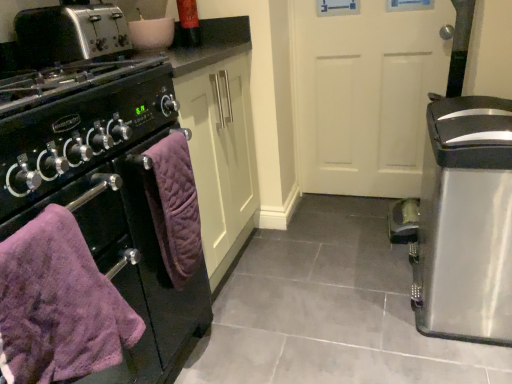
What do you see at coordinates (462, 222) in the screenshot?
I see `satin silver trash can at right` at bounding box center [462, 222].

What do you see at coordinates (70, 33) in the screenshot?
I see `silver metallic toaster at upper left` at bounding box center [70, 33].

What do you see at coordinates (104, 191) in the screenshot? I see `matte black oven at left` at bounding box center [104, 191].

Measure the distance between matte black oven at left and camera.

The distance of matte black oven at left from camera is 27.02 inches.

The height and width of the screenshot is (384, 512). Describe the element at coordinates (59, 304) in the screenshot. I see `purple quilted towel at left, arranged as the second bath towel when viewed from the back` at that location.

In order to click on purple quilted towel at left, the first bath towel in the front-to-back sequence in this screenshot , I will do `click(59, 304)`.

Identify the location of purple quilted towel at lower left, the 1th bath towel when ordered from back to front. (174, 206).

Image resolution: width=512 pixels, height=384 pixels. Describe the element at coordinates (366, 91) in the screenshot. I see `white matte door at center` at that location.

At what (x,y) coordinates should I click in order to perform the action: click on satin silver trash can at right. Please return your answer as a coordinate pair (x, y). Looking at the image, I should click on [x=462, y=222].

Can you confirm if satin silver trash can at right is taller than purple quilted towel at lower left, which appears as the 2th bath towel when viewed from the front?

Correct, satin silver trash can at right is much taller as purple quilted towel at lower left, which appears as the 2th bath towel when viewed from the front.

Is there a large distance between satin silver trash can at right and purple quilted towel at lower left, which appears as the 2th bath towel when viewed from the front?

No, satin silver trash can at right is not far away from purple quilted towel at lower left, which appears as the 2th bath towel when viewed from the front.

From the image's perspective, which bath towel is the 1st one below the satin silver trash can at right? Please provide its 2D coordinates.

[(174, 206)]

Is satin silver trash can at right situated inside purple quilted towel at lower left, the 1th bath towel when ordered from back to front, or outside?

satin silver trash can at right exists outside the volume of purple quilted towel at lower left, the 1th bath towel when ordered from back to front.

Is satin silver trash can at right inside the boundaries of matte black oven at left, or outside?

The correct answer is: outside.

In the scene shown: Is satin silver trash can at right shorter than matte black oven at left?

Yes.

Where is `kitchen appliance behind the matte black oven at left`? Image resolution: width=512 pixels, height=384 pixels. kitchen appliance behind the matte black oven at left is located at coordinates (462, 222).

From the image's perspective, does satin silver trash can at right appear higher than matte black oven at left?

Indeed, from the image's perspective, satin silver trash can at right is shown above matte black oven at left.

In the scene shown: Is silver metallic toaster at upper left located within white matte door at center?

No, silver metallic toaster at upper left is located outside of white matte door at center.

Measure the distance between white matte door at center and silver metallic toaster at upper left.

white matte door at center is 1.16 meters away from silver metallic toaster at upper left.

Is white matte door at center facing away from silver metallic toaster at upper left?

No.

Does white matte door at center have a lesser width compared to silver metallic toaster at upper left?

Indeed, white matte door at center has a lesser width compared to silver metallic toaster at upper left.

Considering their positions, is satin silver trash can at right located in front of or behind white matte door at center?

Clearly, satin silver trash can at right is in front of white matte door at center.

The image size is (512, 384). I want to click on kitchen appliance that is under the white matte door at center (from a real-world perspective), so click(x=462, y=222).

Considering the positions of objects satin silver trash can at right and white matte door at center in the image provided, who is more to the left, satin silver trash can at right or white matte door at center?

white matte door at center.

Considering the sizes of objects white matte door at center and purple quilted towel at left, arranged as the second bath towel when viewed from the back, in the image provided, who is smaller, white matte door at center or purple quilted towel at left, arranged as the second bath towel when viewed from the back,?

With smaller size is purple quilted towel at left, arranged as the second bath towel when viewed from the back.

Is white matte door at center located outside purple quilted towel at left, the first bath towel in the front-to-back sequence?

Yes, white matte door at center is not within purple quilted towel at left, the first bath towel in the front-to-back sequence.

From a real-world perspective, is white matte door at center beneath purple quilted towel at left, the first bath towel in the front-to-back sequence?

Yes, from a real-world perspective, white matte door at center is under purple quilted towel at left, the first bath towel in the front-to-back sequence.

The image size is (512, 384). Find the location of `the 2nd bath towel below the white matte door at center (from the image's perspective)`. the 2nd bath towel below the white matte door at center (from the image's perspective) is located at coordinates tap(59, 304).

Is purple quilted towel at left, the first bath towel in the front-to-back sequence, next to matte black oven at left?

No, purple quilted towel at left, the first bath towel in the front-to-back sequence, is not with matte black oven at left.

Is purple quilted towel at left, arranged as the second bath towel when viewed from the back, taller or shorter than matte black oven at left?

Clearly, purple quilted towel at left, arranged as the second bath towel when viewed from the back, is shorter compared to matte black oven at left.

From a real-world perspective, which object rests below the other?

In real-world perspective, matte black oven at left is lower.

Is purple quilted towel at left, arranged as the second bath towel when viewed from the back, thinner than matte black oven at left?

Yes.

Is point (362, 27) positioned after point (510, 177)?

Yes, it is.

Which is more to the right, white matte door at center or satin silver trash can at right?

satin silver trash can at right.

Considering the relative sizes of white matte door at center and satin silver trash can at right in the image provided, is white matte door at center wider than satin silver trash can at right?

No.

Locate an element on the screen. This screenshot has width=512, height=384. kitchen appliance that is on the right side of white matte door at center is located at coordinates (462, 222).

This screenshot has width=512, height=384. I want to click on bath towel that is the 1st object above the satin silver trash can at right (from a real-world perspective), so click(x=174, y=206).

The height and width of the screenshot is (384, 512). In order to click on kitchen appliance below the matte black oven at left (from a real-world perspective) in this screenshot , I will do `click(462, 222)`.

Estimate the real-world distances between objects in this image. Which object is closer to satin silver trash can at right, white matte door at center or purple quilted towel at lower left, which appears as the 2th bath towel when viewed from the front?

white matte door at center is closer to satin silver trash can at right.

Looking at the image, which one is located further to silver metallic toaster at upper left, purple quilted towel at lower left, which appears as the 2th bath towel when viewed from the front, or matte black oven at left?

purple quilted towel at lower left, which appears as the 2th bath towel when viewed from the front, lies further to silver metallic toaster at upper left than the other object.

Considering their positions, is silver metallic toaster at upper left positioned closer to satin silver trash can at right than purple quilted towel at left, arranged as the second bath towel when viewed from the back?

Answer: purple quilted towel at left, arranged as the second bath towel when viewed from the back, is positioned closer to the anchor satin silver trash can at right.

Looking at the image, which one is located closer to silver metallic toaster at upper left, purple quilted towel at left, arranged as the second bath towel when viewed from the back, or matte black oven at left?

Among the two, matte black oven at left is located nearer to silver metallic toaster at upper left.

Estimate the real-world distances between objects in this image. Which object is closer to silver metallic toaster at upper left, satin silver trash can at right or purple quilted towel at lower left, the 1th bath towel when ordered from back to front?

Based on the image, purple quilted towel at lower left, the 1th bath towel when ordered from back to front, appears to be nearer to silver metallic toaster at upper left.

Which object lies further to the anchor point purple quilted towel at lower left, the 1th bath towel when ordered from back to front, satin silver trash can at right or matte black oven at left?

The object further to purple quilted towel at lower left, the 1th bath towel when ordered from back to front, is satin silver trash can at right.

Estimate the real-world distances between objects in this image. Which object is further from purple quilted towel at left, arranged as the second bath towel when viewed from the back, silver metallic toaster at upper left or matte black oven at left?

Based on the image, silver metallic toaster at upper left appears to be further to purple quilted towel at left, arranged as the second bath towel when viewed from the back.

Which object lies further to the anchor point purple quilted towel at lower left, which appears as the 2th bath towel when viewed from the front, silver metallic toaster at upper left or purple quilted towel at left, arranged as the second bath towel when viewed from the back?

The object further to purple quilted towel at lower left, which appears as the 2th bath towel when viewed from the front, is silver metallic toaster at upper left.

I want to click on bath towel located between purple quilted towel at left, the first bath towel in the front-to-back sequence, and satin silver trash can at right in the left-right direction, so click(x=174, y=206).

The height and width of the screenshot is (384, 512). Find the location of `home appliance located between silver metallic toaster at upper left and white matte door at center in the left-right direction`. home appliance located between silver metallic toaster at upper left and white matte door at center in the left-right direction is located at coordinates (104, 191).

The image size is (512, 384). I want to click on home appliance located between purple quilted towel at left, arranged as the second bath towel when viewed from the back, and purple quilted towel at lower left, the 1th bath towel when ordered from back to front, in the depth direction, so [104, 191].

Where is `home appliance located between silver metallic toaster at upper left and satin silver trash can at right in the left-right direction`? home appliance located between silver metallic toaster at upper left and satin silver trash can at right in the left-right direction is located at coordinates (104, 191).